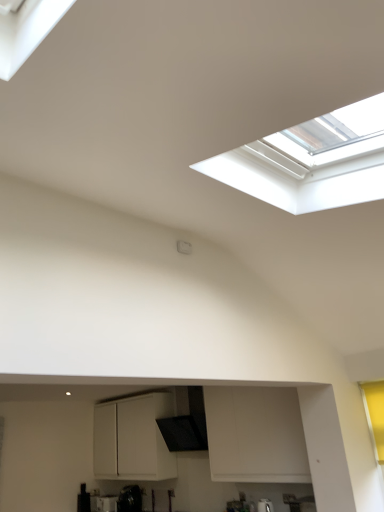
Question: Does white matte cabinet at center have a lesser height compared to black glossy kettle at lower center?

Choices:
 (A) yes
 (B) no

Answer: (B)

Question: Considering the relative sizes of white matte cabinet at center and black glossy kettle at lower center in the image provided, is white matte cabinet at center taller than black glossy kettle at lower center?

Choices:
 (A) no
 (B) yes

Answer: (B)

Question: From the image's perspective, would you say white matte cabinet at center is shown under black glossy kettle at lower center?

Choices:
 (A) no
 (B) yes

Answer: (A)

Question: Is white matte cabinet at center to the left of black glossy kettle at lower center from the viewer's perspective?

Choices:
 (A) no
 (B) yes

Answer: (A)

Question: From a real-world perspective, is white matte cabinet at center on top of black glossy kettle at lower center?

Choices:
 (A) yes
 (B) no

Answer: (A)

Question: Is black textured exhaust hood at center to the left or to the right of white matte cabinet at center in the image?

Choices:
 (A) left
 (B) right

Answer: (B)

Question: Considering their positions, is black textured exhaust hood at center located in front of or behind white matte cabinet at center?

Choices:
 (A) front
 (B) behind

Answer: (A)

Question: From a real-world perspective, is black textured exhaust hood at center above or below white matte cabinet at center?

Choices:
 (A) below
 (B) above

Answer: (B)

Question: Would you say black textured exhaust hood at center is inside or outside white matte cabinet at center?

Choices:
 (A) inside
 (B) outside

Answer: (B)

Question: Does point (132, 460) appear closer or farther from the camera than point (168, 424)?

Choices:
 (A) closer
 (B) farther

Answer: (B)

Question: Considering the relative positions of white matte cabinet at center and black textured exhaust hood at center in the image provided, is white matte cabinet at center to the left or to the right of black textured exhaust hood at center?

Choices:
 (A) left
 (B) right

Answer: (A)

Question: From the image's perspective, is white matte cabinet at center located above or below black textured exhaust hood at center?

Choices:
 (A) above
 (B) below

Answer: (B)

Question: From a real-world perspective, is white matte cabinet at center above or below black textured exhaust hood at center?

Choices:
 (A) below
 (B) above

Answer: (A)

Question: Is white matte cabinet at center wider or thinner than black glossy kettle at lower center?

Choices:
 (A) thin
 (B) wide

Answer: (B)

Question: Is white matte cabinet at center in front of or behind black glossy kettle at lower center in the image?

Choices:
 (A) behind
 (B) front

Answer: (B)